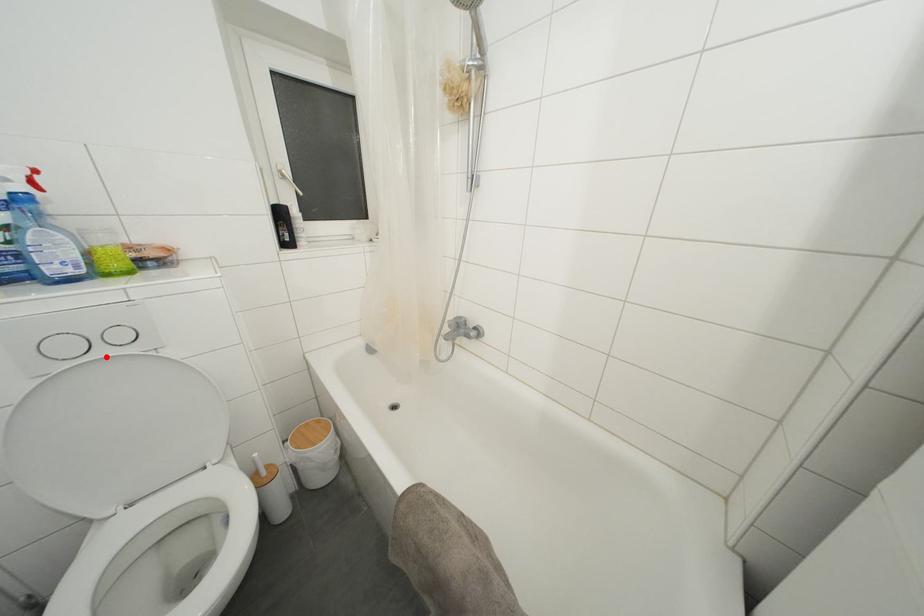
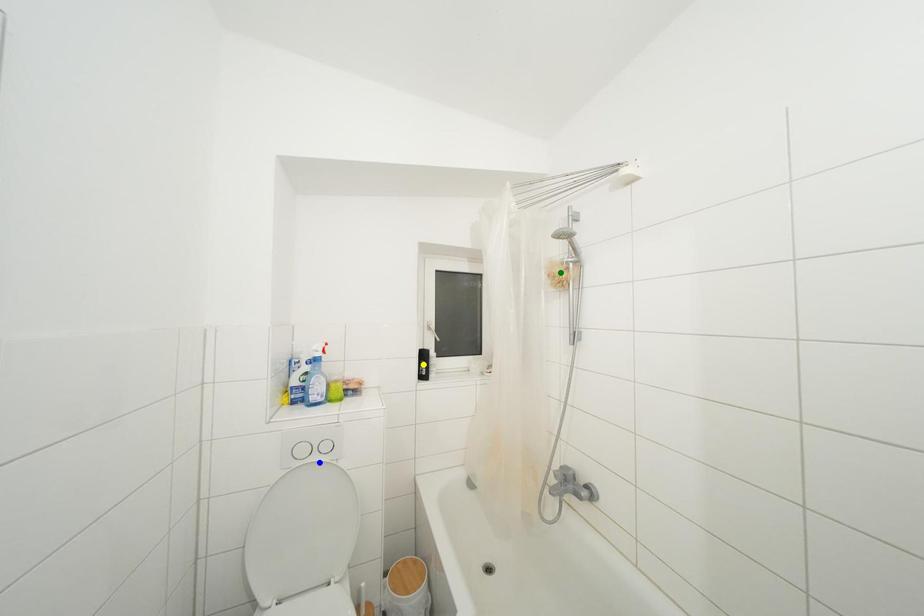
Question: I am providing you with two images of the same scene from different viewpoints. A red point is marked on the first image. You are given multiple points on the second image. Which mark in image 2 goes with the point in image 1?

Choices:
 (A) blue point
 (B) yellow point
 (C) green point

Answer: (A)